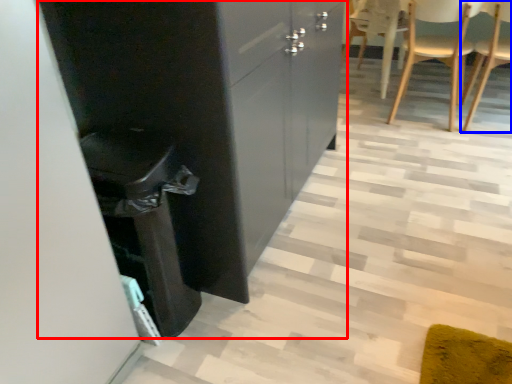
Question: Which object appears closest to the camera in this image, cabinetry (highlighted by a red box) or chair (highlighted by a blue box)?

Choices:
 (A) cabinetry
 (B) chair

Answer: (A)